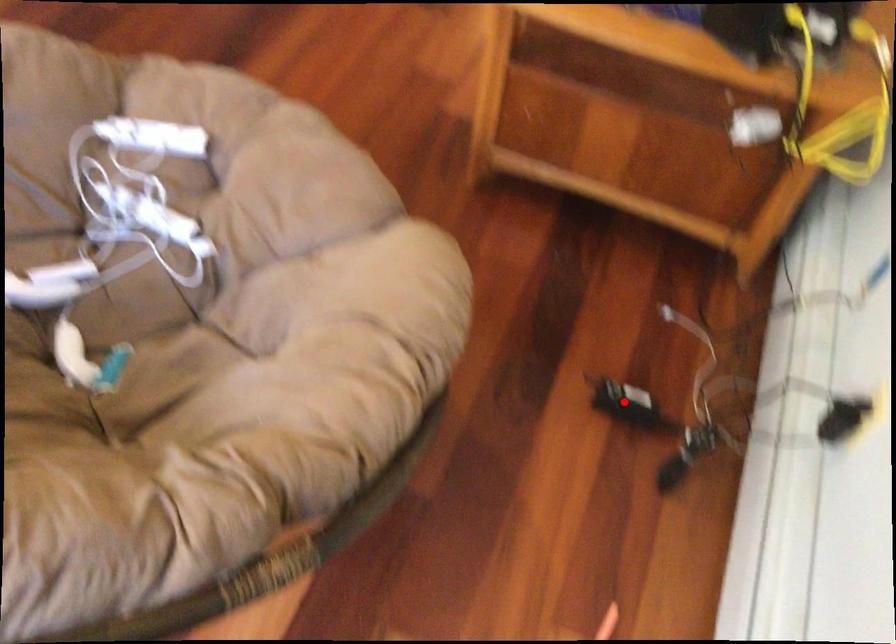
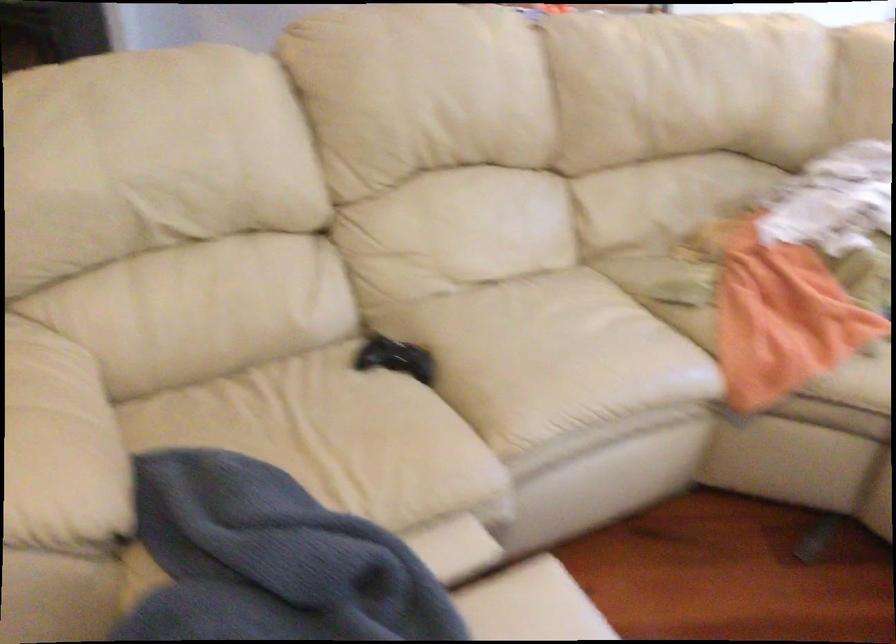
Question: I am providing you with two images of the same scene from different viewpoints. A red point is marked on the first image. Can you still see the location of the red point in image 2?

Choices:
 (A) Yes
 (B) No

Answer: (B)